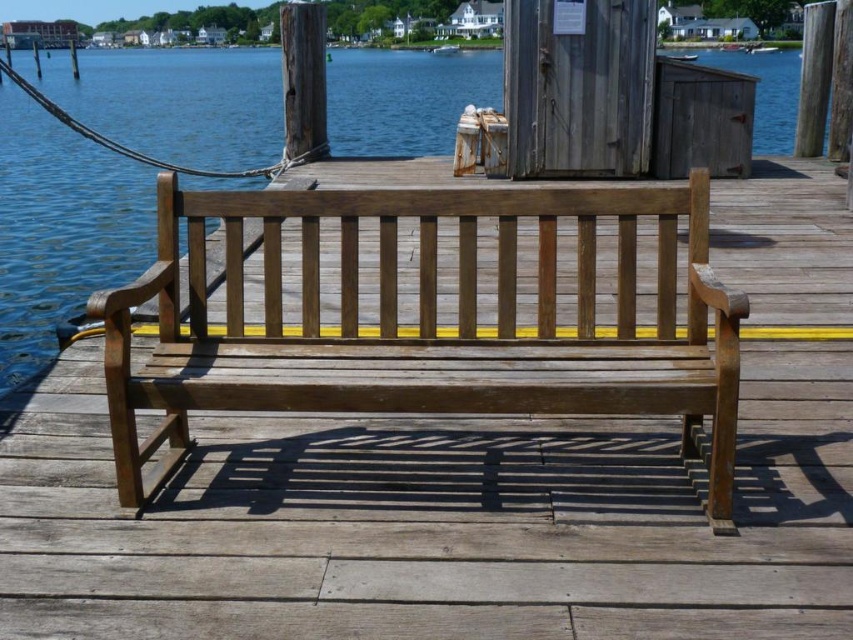
Question: Which point is closer to the camera?

Choices:
 (A) transparent blue water at center
 (B) matte wood bench at center

Answer: (B)

Question: Is matte wood bench at center in front of transparent blue water at center?

Choices:
 (A) yes
 (B) no

Answer: (A)

Question: Is matte wood bench at center wider than transparent blue water at center?

Choices:
 (A) yes
 (B) no

Answer: (B)

Question: Does matte wood bench at center come behind transparent blue water at center?

Choices:
 (A) yes
 (B) no

Answer: (B)

Question: Among these objects, which one is nearest to the camera?

Choices:
 (A) transparent blue water at center
 (B) matte wood bench at center

Answer: (B)